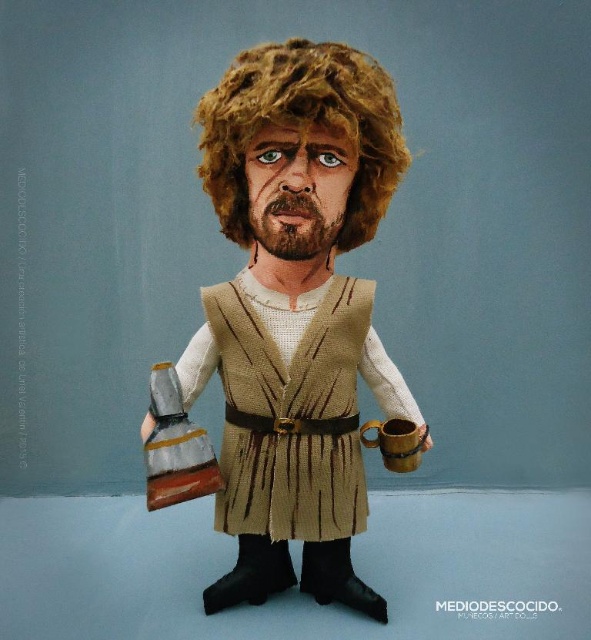
In the scene shown: Who is shorter, matte brown vest at center or curly blonde wig at upper center?

curly blonde wig at upper center

Is point (212, 179) closer to viewer compared to point (228, 138)?

That is False.

Find the location of a particular element. This screenshot has height=640, width=591. matte brown vest at center is located at coordinates (297, 310).